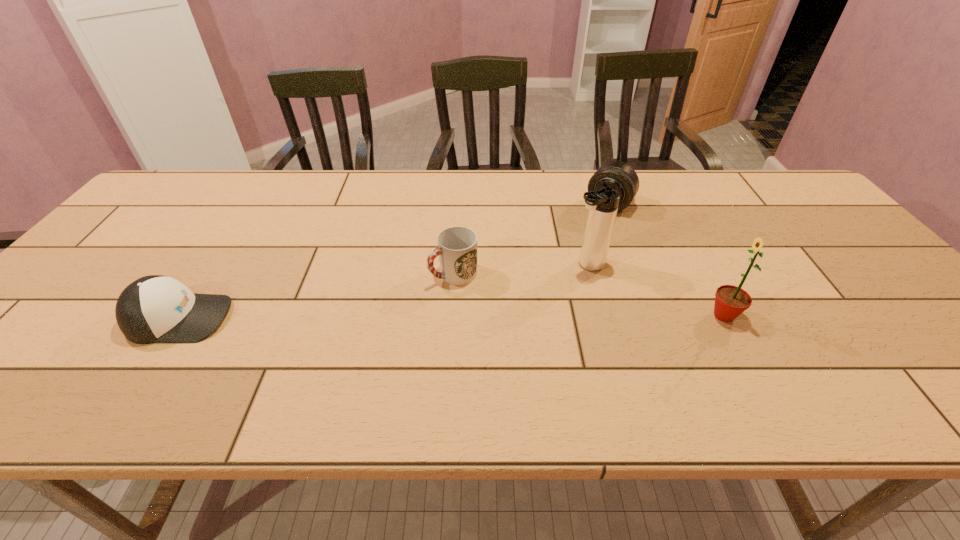
What are the coordinates of `vacant area situated 0.050m on the handle side of the thermos bottle` in the screenshot? It's located at (558, 278).

Where is `blank space located on the handle side of the thermos bottle`? The width and height of the screenshot is (960, 540). blank space located on the handle side of the thermos bottle is located at coordinates (491, 309).

The height and width of the screenshot is (540, 960). What are the coordinates of `vacant region located 0.150m on the handle side of the thermos bottle` in the screenshot? It's located at point(525,293).

Find the location of `vacant space located on the front-facing side of the telephoto lens`. vacant space located on the front-facing side of the telephoto lens is located at coordinates (567, 262).

Image resolution: width=960 pixels, height=540 pixels. What are the coordinates of `blank area located 0.340m on the front-facing side of the telephoto lens` in the screenshot? It's located at (550, 285).

You are a GUI agent. You are given a task and a screenshot of the screen. Output one action in this format:
    pyautogui.click(x=<x>, y=<y>)
    Task: Click on the blank area located 0.210m on the front-facing side of the telephoto lens
    The height and width of the screenshot is (540, 960).
    Given the screenshot: What is the action you would take?
    pyautogui.click(x=571, y=255)

The width and height of the screenshot is (960, 540). Identify the location of vacant space positioned on the handle side of the cup. (353, 325).

The width and height of the screenshot is (960, 540). What are the coordinates of `free location located 0.190m on the handle side of the cup` in the screenshot? It's located at (365, 319).

Locate an element on the screen. The width and height of the screenshot is (960, 540). free location located on the handle side of the cup is located at coordinates (407, 298).

Locate an element on the screen. object that is at the far edge is located at coordinates (620, 176).